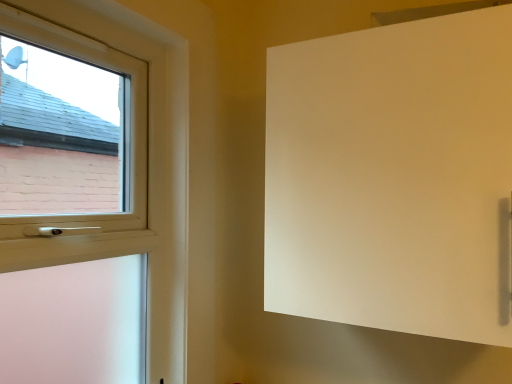
Question: Is white matte screen door at upper right turned away from white plastic window at left?

Choices:
 (A) no
 (B) yes

Answer: (A)

Question: From the image's perspective, would you say white matte screen door at upper right is positioned over white plastic window at left?

Choices:
 (A) yes
 (B) no

Answer: (A)

Question: Can you confirm if white matte screen door at upper right is wider than white plastic window at left?

Choices:
 (A) yes
 (B) no

Answer: (A)

Question: Does white matte screen door at upper right appear on the right side of white plastic window at left?

Choices:
 (A) yes
 (B) no

Answer: (A)

Question: Is white matte screen door at upper right not within white plastic window at left?

Choices:
 (A) no
 (B) yes

Answer: (B)

Question: Does white matte screen door at upper right have a larger size compared to white plastic window at left?

Choices:
 (A) yes
 (B) no

Answer: (A)

Question: Does white plastic window at left appear on the left side of white matte screen door at upper right?

Choices:
 (A) yes
 (B) no

Answer: (A)

Question: Is white plastic window at left not within white matte screen door at upper right?

Choices:
 (A) no
 (B) yes

Answer: (B)

Question: From the image's perspective, is white plastic window at left on top of white matte screen door at upper right?

Choices:
 (A) no
 (B) yes

Answer: (A)

Question: Does white plastic window at left lie behind white matte screen door at upper right?

Choices:
 (A) yes
 (B) no

Answer: (B)

Question: Does white plastic window at left have a lesser height compared to white matte screen door at upper right?

Choices:
 (A) no
 (B) yes

Answer: (A)

Question: Can you confirm if white plastic window at left is positioned to the right of white matte screen door at upper right?

Choices:
 (A) no
 (B) yes

Answer: (A)

Question: Does point (304, 89) appear closer or farther from the camera than point (178, 72)?

Choices:
 (A) closer
 (B) farther

Answer: (A)